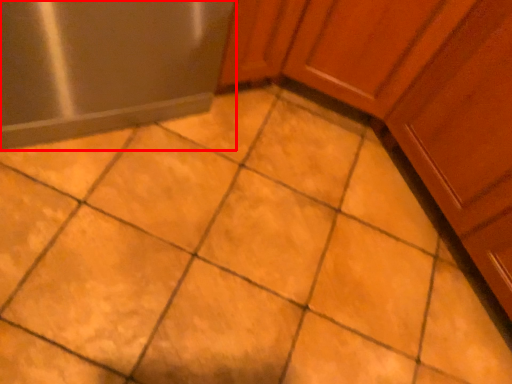
Question: From the image, what is the correct spatial relationship of appliance (annotated by the red box) in relation to cabinetry?

Choices:
 (A) left
 (B) right

Answer: (A)